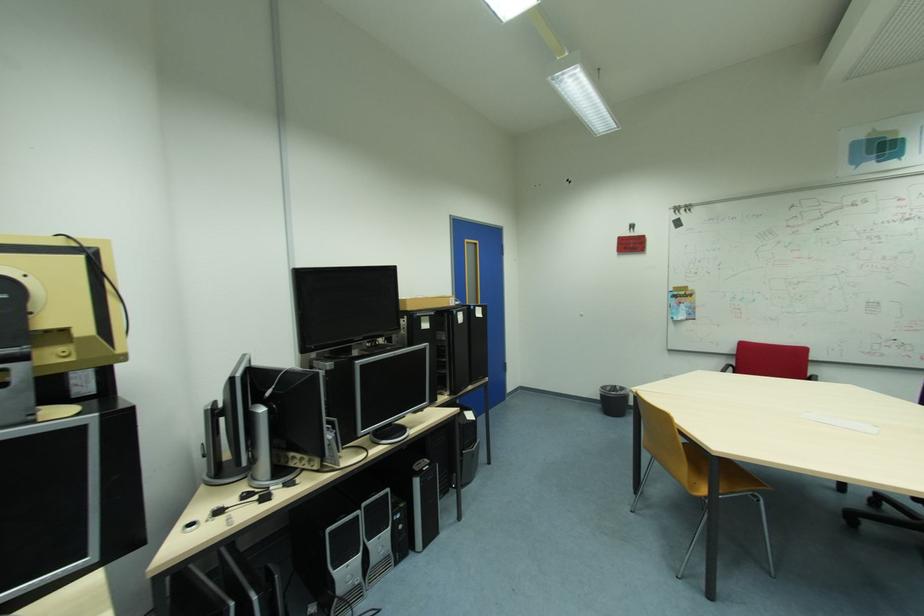
What do you see at coordinates (708, 475) in the screenshot? I see `the yellow chair sitting surface` at bounding box center [708, 475].